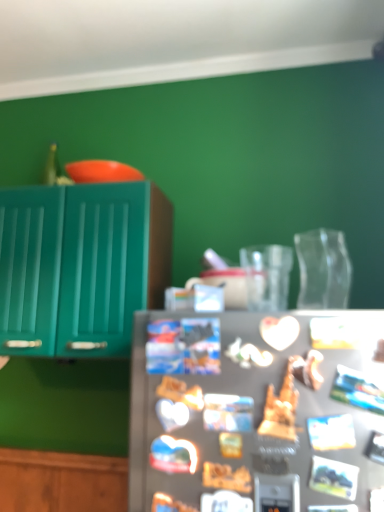
Question: Is satin silver fridge at center beside satin silver refrigerator at center?

Choices:
 (A) no
 (B) yes

Answer: (A)

Question: Is satin silver fridge at center facing away from satin silver refrigerator at center?

Choices:
 (A) yes
 (B) no

Answer: (B)

Question: From the image's perspective, is satin silver fridge at center located above satin silver refrigerator at center?

Choices:
 (A) yes
 (B) no

Answer: (A)

Question: Is satin silver refrigerator at center located within satin silver fridge at center?

Choices:
 (A) yes
 (B) no

Answer: (A)

Question: Considering the relative positions of satin silver fridge at center and satin silver refrigerator at center in the image provided, is satin silver fridge at center in front of satin silver refrigerator at center?

Choices:
 (A) yes
 (B) no

Answer: (A)

Question: Considering their positions, is satin silver refrigerator at center located in front of or behind satin silver fridge at center?

Choices:
 (A) behind
 (B) front

Answer: (A)

Question: Considering the positions of point (284, 479) and point (228, 390), is point (284, 479) closer or farther from the camera than point (228, 390)?

Choices:
 (A) closer
 (B) farther

Answer: (A)

Question: In terms of size, does satin silver refrigerator at center appear bigger or smaller than satin silver fridge at center?

Choices:
 (A) big
 (B) small

Answer: (B)

Question: Is satin silver refrigerator at center taller or shorter than satin silver fridge at center?

Choices:
 (A) tall
 (B) short

Answer: (B)

Question: From the image's perspective, is teal glossy cabinet at left located above or below satin silver refrigerator at center?

Choices:
 (A) below
 (B) above

Answer: (B)

Question: Visually, is teal glossy cabinet at left positioned to the left or to the right of satin silver refrigerator at center?

Choices:
 (A) left
 (B) right

Answer: (A)

Question: Is point (89, 202) positioned closer to the camera than point (256, 476)?

Choices:
 (A) closer
 (B) farther

Answer: (B)

Question: Based on their sizes in the image, would you say teal glossy cabinet at left is bigger or smaller than satin silver refrigerator at center?

Choices:
 (A) big
 (B) small

Answer: (A)

Question: Do you think teal glossy cabinet at left is within satin silver fridge at center, or outside of it?

Choices:
 (A) inside
 (B) outside

Answer: (B)

Question: From a real-world perspective, is teal glossy cabinet at left physically located above or below satin silver fridge at center?

Choices:
 (A) above
 (B) below

Answer: (A)